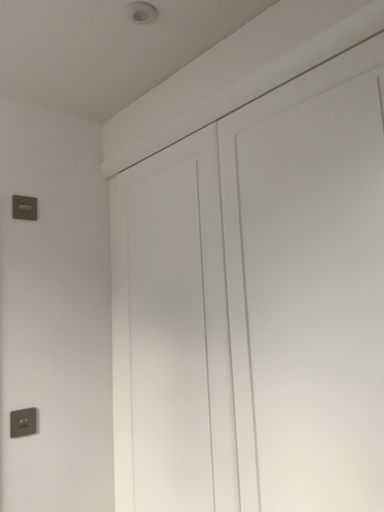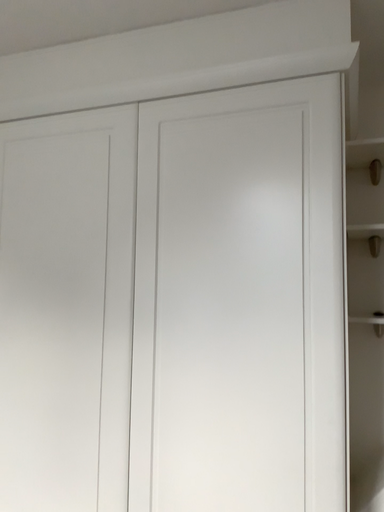
Question: How did the camera likely rotate when shooting the video?

Choices:
 (A) rotated right
 (B) rotated left

Answer: (A)